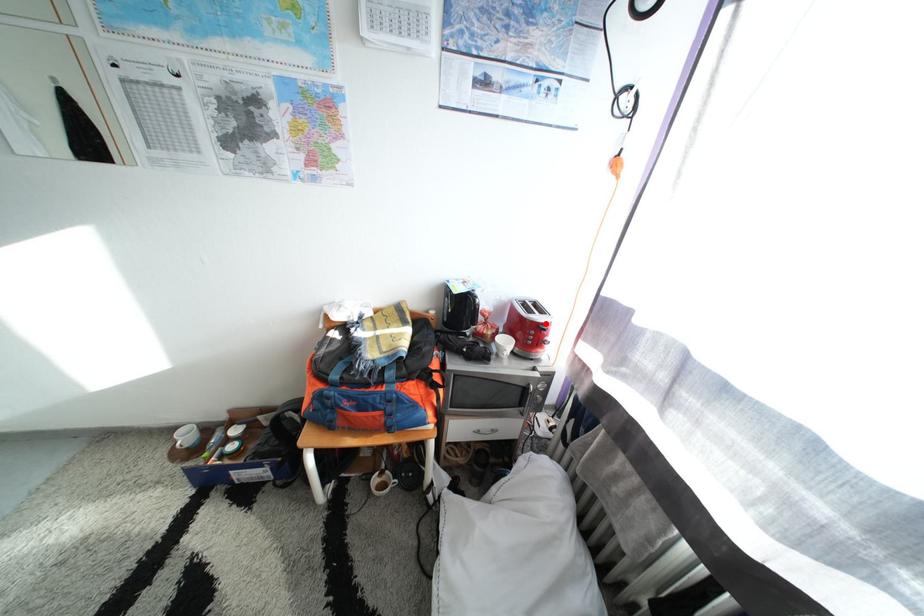
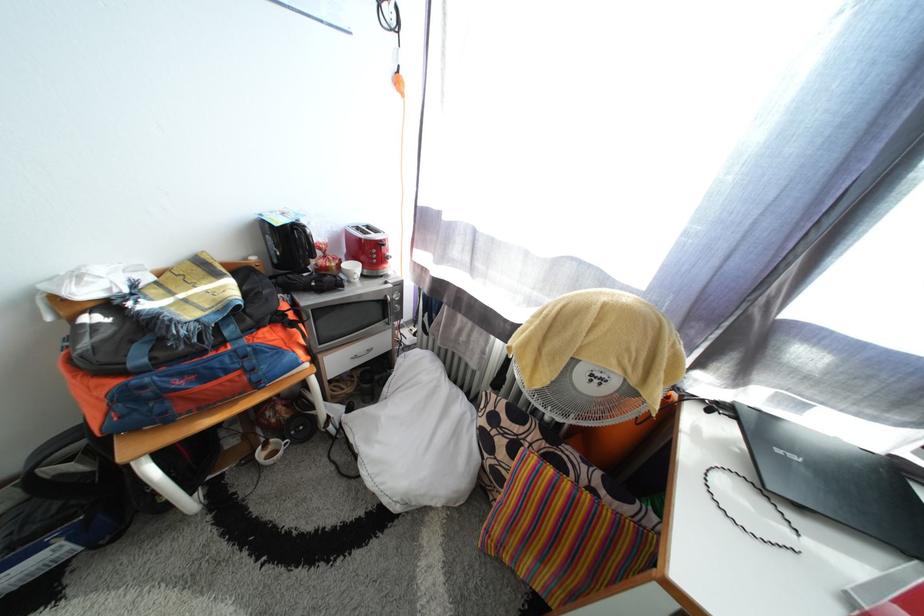
In the second image, find the point that corresponds to the highlighted location in the first image.

(383, 243)